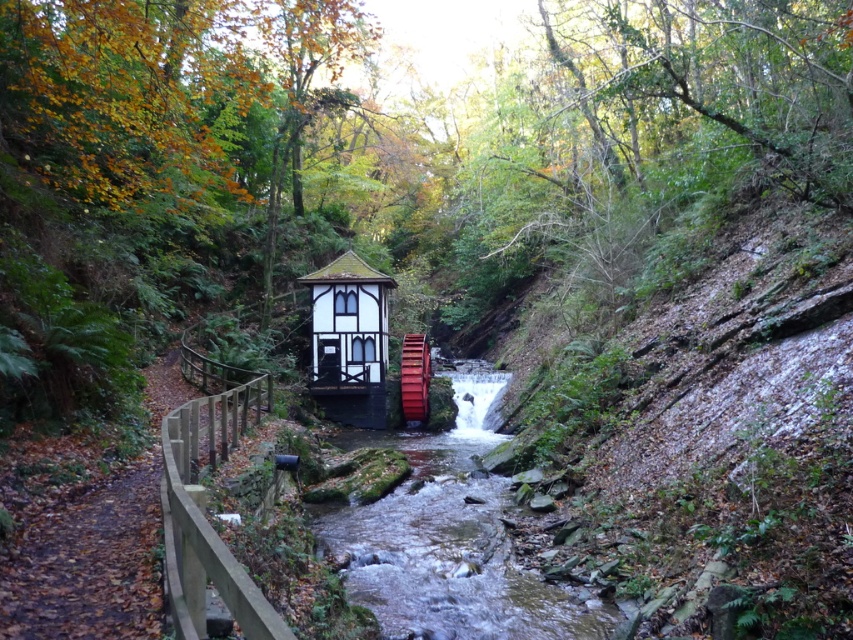
Question: Can you confirm if smooth concrete creek at center is bigger than white wood gazebo at center?

Choices:
 (A) no
 (B) yes

Answer: (B)

Question: Is smooth concrete creek at center to the left of white wood gazebo at center from the viewer's perspective?

Choices:
 (A) yes
 (B) no

Answer: (B)

Question: Which point is farther to the camera?

Choices:
 (A) smooth concrete creek at center
 (B) white wood gazebo at center

Answer: (B)

Question: Which object appears farthest from the camera in this image?

Choices:
 (A) white wood gazebo at center
 (B) smooth concrete creek at center

Answer: (A)

Question: Considering the relative positions of smooth concrete creek at center and white wood gazebo at center in the image provided, where is smooth concrete creek at center located with respect to white wood gazebo at center?

Choices:
 (A) above
 (B) below

Answer: (B)